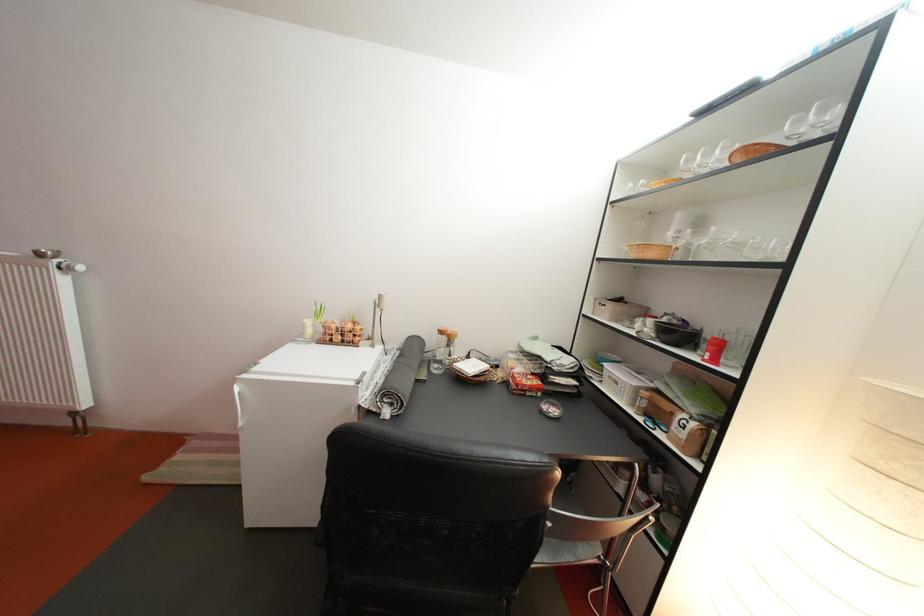
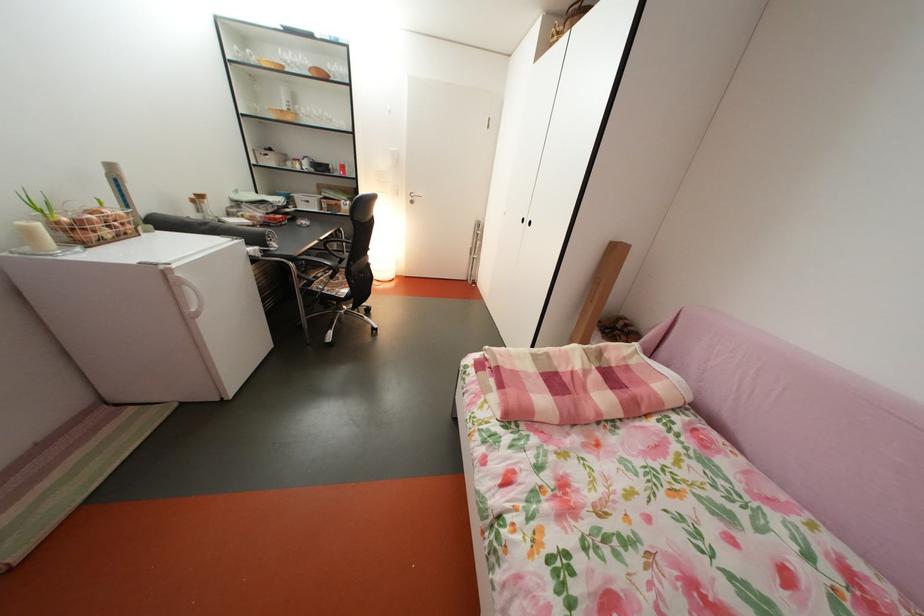
Locate, in the second image, the point that corresponds to (x=348, y=344) in the first image.

(118, 238)